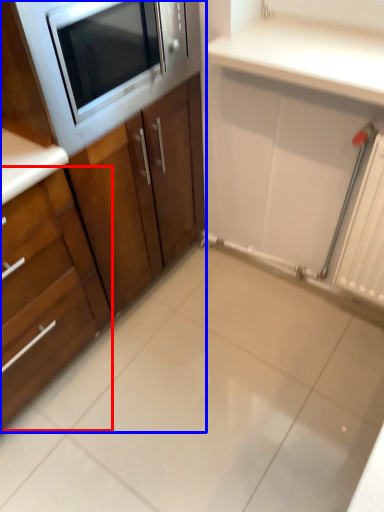
Question: Which object is further to the camera taking this photo, cabinetry (highlighted by a red box) or cabinetry (highlighted by a blue box)?

Choices:
 (A) cabinetry
 (B) cabinetry

Answer: (B)